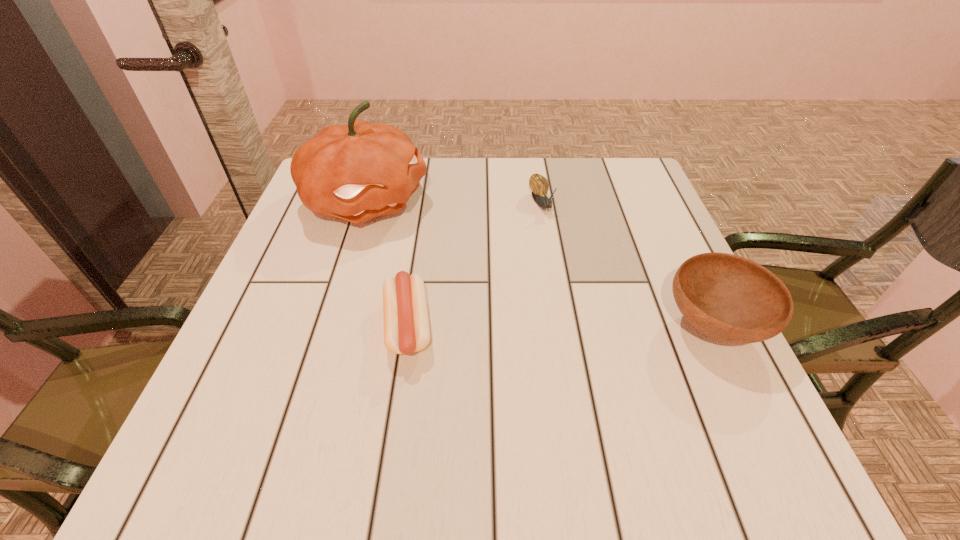
Find the location of a particular element. The image size is (960, 540). sausage is located at coordinates (406, 323).

You are a GUI agent. You are given a task and a screenshot of the screen. Output one action in this format:
    pyautogui.click(x=<x>, y=<y>)
    Task: Click on the rightmost object
    Image resolution: width=960 pixels, height=540 pixels.
    Given the screenshot: What is the action you would take?
    pyautogui.click(x=729, y=298)

At what (x,y) coordinates should I click in order to perform the action: click on bowl. Please return your answer as a coordinate pair (x, y). This screenshot has height=540, width=960. Looking at the image, I should click on [x=729, y=298].

Locate an element on the screen. This screenshot has height=540, width=960. pumpkin is located at coordinates (358, 171).

This screenshot has width=960, height=540. What are the coordinates of `escargot` in the screenshot? It's located at (539, 185).

Identify the location of vacant space located on the right of the sausage. (572, 327).

Where is `free space located 0.070m on the back of the bowl`? The width and height of the screenshot is (960, 540). free space located 0.070m on the back of the bowl is located at coordinates (684, 265).

Image resolution: width=960 pixels, height=540 pixels. Identify the location of vacant area situated on the front face of the pumpkin. (513, 289).

At what (x,y) coordinates should I click in order to perform the action: click on vacant space positioned on the front face of the pumpkin. Please return your answer as a coordinate pair (x, y). The image size is (960, 540). Looking at the image, I should click on (483, 271).

Where is `free space located on the front face of the pumpkin`? free space located on the front face of the pumpkin is located at coordinates (463, 259).